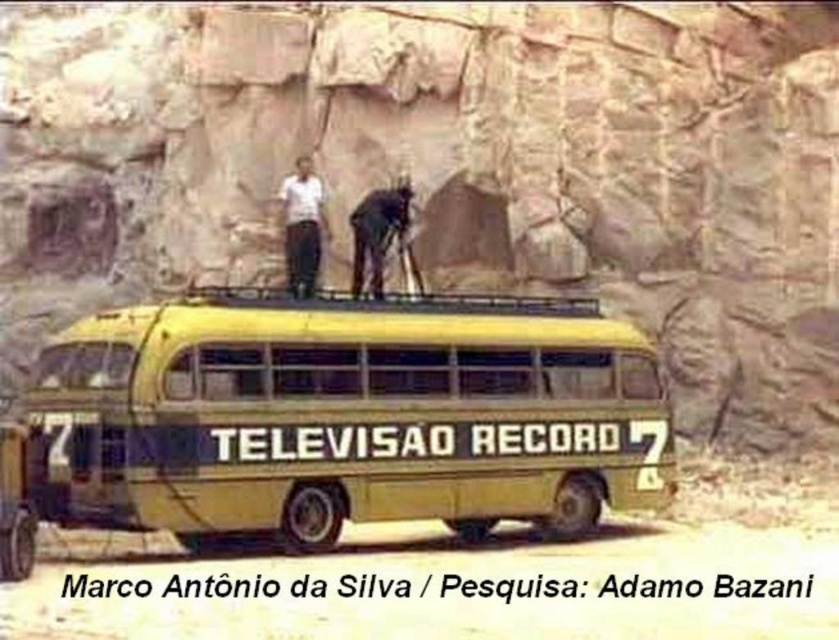
Question: Can you confirm if rough stone wall at upper center is smaller than yellow matte bus at center?

Choices:
 (A) yes
 (B) no

Answer: (B)

Question: Does yellow matte bus at center have a greater width compared to white matte shirt at upper center?

Choices:
 (A) yes
 (B) no

Answer: (A)

Question: Among these objects, which one is nearest to the camera?

Choices:
 (A) white matte shirt at upper center
 (B) rough stone wall at upper center

Answer: (A)

Question: Which of the following is the closest to the observer?

Choices:
 (A) (314, 232)
 (B) (272, 220)

Answer: (A)

Question: Estimate the real-world distances between objects in this image. Which object is farther from the white matte shirt at upper center?

Choices:
 (A) yellow matte bus at center
 (B) rough stone wall at upper center

Answer: (B)

Question: Can you confirm if rough stone wall at upper center is bigger than yellow matte bus at center?

Choices:
 (A) yes
 (B) no

Answer: (A)